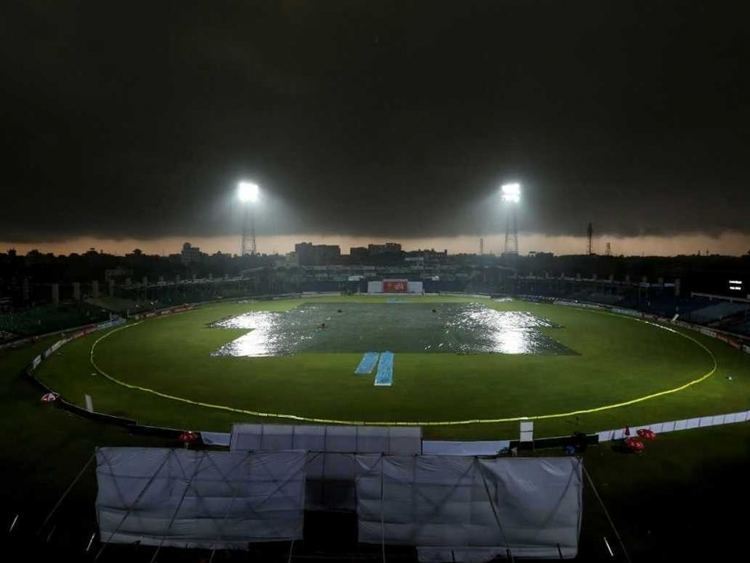
This screenshot has width=750, height=563. Identify the location of lights. (256, 195), (526, 187).